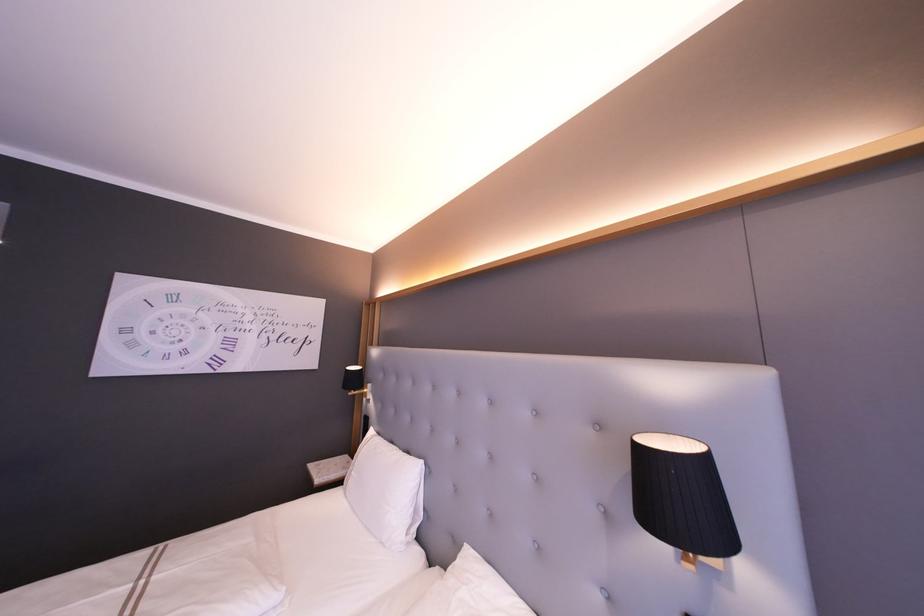
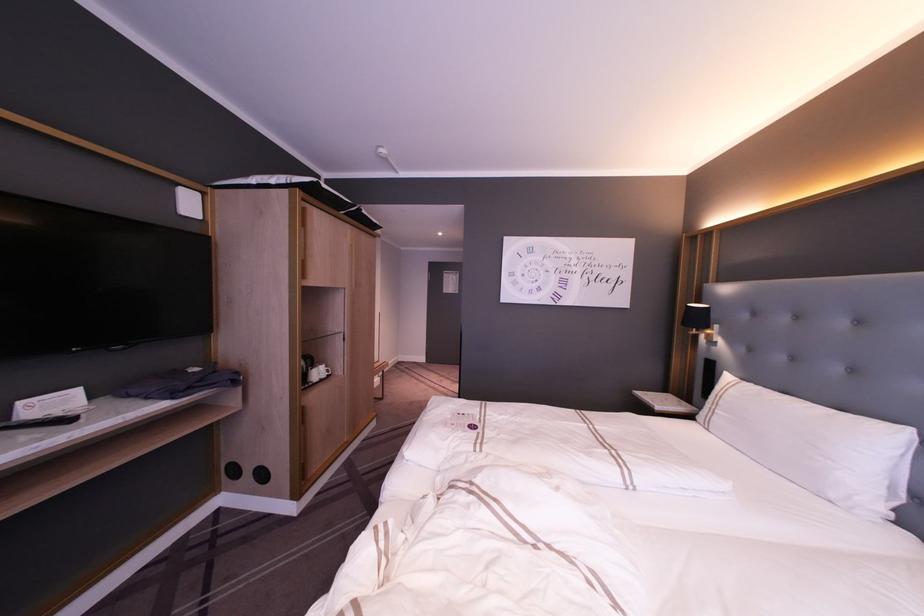
Where in the second image is the point corresponding to [369,385] from the first image?

(715, 326)